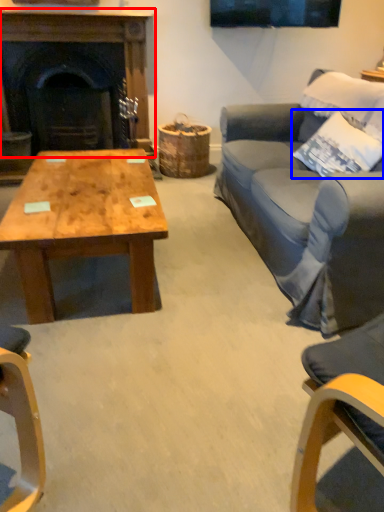
Question: Which of the following is the farthest to the observer, fireplace (highlighted by a red box) or pillow (highlighted by a blue box)?

Choices:
 (A) fireplace
 (B) pillow

Answer: (A)